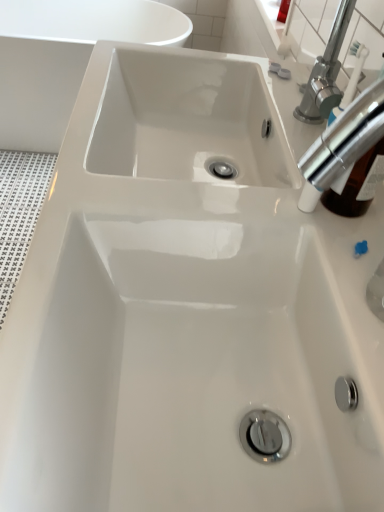
Measure the distance between white glossy bathtub at upper left and camera.

white glossy bathtub at upper left and camera are 2.10 meters apart from each other.

In order to face white glossy bathtub at upper left, should I rotate leftwards or rightwards?

A 14.519 degree turn to the left will do.

Measure the distance between point (162, 24) and camera.

Point (162, 24) and camera are 7.17 feet apart from each other.

The width and height of the screenshot is (384, 512). Describe the element at coordinates (65, 58) in the screenshot. I see `white glossy bathtub at upper left` at that location.

Locate an element on the screen. This screenshot has width=384, height=512. white glossy bathtub at upper left is located at coordinates (65, 58).

The image size is (384, 512). What are the coordinates of `chrome metallic tap at upper right` in the screenshot? It's located at (342, 144).

This screenshot has width=384, height=512. What do you see at coordinates (342, 144) in the screenshot?
I see `chrome metallic tap at upper right` at bounding box center [342, 144].

Locate an element on the screen. white glossy bathtub at upper left is located at coordinates (65, 58).

Is chrome metallic tap at upper right to the left of white glossy bathtub at upper left from the viewer's perspective?

No.

Is the position of chrome metallic tap at upper right less distant than that of white glossy bathtub at upper left?

Yes.

Which is behind, point (375, 99) or point (80, 15)?

Positioned behind is point (80, 15).

From the image's perspective, which one is positioned higher, chrome metallic tap at upper right or white glossy bathtub at upper left?

white glossy bathtub at upper left is shown above in the image.

From a real-world perspective, which object stands above the other?

In real-world perspective, chrome metallic tap at upper right is above.

Consider the image. Is chrome metallic tap at upper right wider than white glossy bathtub at upper left?

Incorrect, the width of chrome metallic tap at upper right does not surpass that of white glossy bathtub at upper left.

From their relative heights in the image, would you say chrome metallic tap at upper right is taller or shorter than white glossy bathtub at upper left?

Clearly, chrome metallic tap at upper right is shorter compared to white glossy bathtub at upper left.

Considering the relative sizes of chrome metallic tap at upper right and white glossy bathtub at upper left in the image provided, is chrome metallic tap at upper right smaller than white glossy bathtub at upper left?

Correct, chrome metallic tap at upper right occupies less space than white glossy bathtub at upper left.

Is white glossy bathtub at upper left located within chrome metallic tap at upper right?

No.

Based on the photo, can you see chrome metallic tap at upper right touching white glossy bathtub at upper left?

chrome metallic tap at upper right and white glossy bathtub at upper left are clearly separated.

Does chrome metallic tap at upper right turn towards white glossy bathtub at upper left?

No, chrome metallic tap at upper right is not oriented towards white glossy bathtub at upper left.

Where is `bath behind the chrome metallic tap at upper right`? This screenshot has height=512, width=384. bath behind the chrome metallic tap at upper right is located at coordinates (65, 58).

Considering the positions of objects white glossy bathtub at upper left and chrome metallic tap at upper right in the image provided, who is more to the right, white glossy bathtub at upper left or chrome metallic tap at upper right?

From the viewer's perspective, chrome metallic tap at upper right appears more on the right side.

Is white glossy bathtub at upper left closer to camera compared to chrome metallic tap at upper right?

That is False.

Which is nearer, (40, 6) or (339, 155)?

Point (40, 6).

From the image's perspective, does white glossy bathtub at upper left appear higher than chrome metallic tap at upper right?

Yes.

From a real-world perspective, which object stands above the other?

chrome metallic tap at upper right is physically above.

Between white glossy bathtub at upper left and chrome metallic tap at upper right, which one has larger width?

white glossy bathtub at upper left.

Which of these two, white glossy bathtub at upper left or chrome metallic tap at upper right, stands taller?

With more height is white glossy bathtub at upper left.

Does white glossy bathtub at upper left have a smaller size compared to chrome metallic tap at upper right?

Actually, white glossy bathtub at upper left might be larger than chrome metallic tap at upper right.

Would you say white glossy bathtub at upper left is outside chrome metallic tap at upper right?

That's correct, white glossy bathtub at upper left is outside of chrome metallic tap at upper right.

Is white glossy bathtub at upper left far away from chrome metallic tap at upper right?

Yes, white glossy bathtub at upper left is far from chrome metallic tap at upper right.

Is white glossy bathtub at upper left turned away from chrome metallic tap at upper right?

white glossy bathtub at upper left is not turned away from chrome metallic tap at upper right.

How different are the orientations of white glossy bathtub at upper left and chrome metallic tap at upper right in degrees?

90.3 degrees.

Based on the photo, measure the distance from white glossy bathtub at upper left to chrome metallic tap at upper right.

white glossy bathtub at upper left is 6.39 feet away from chrome metallic tap at upper right.

Identify the location of tap that appears below the white glossy bathtub at upper left (from the image's perspective). Image resolution: width=384 pixels, height=512 pixels. (342, 144).

This screenshot has height=512, width=384. Find the location of `bath behind the chrome metallic tap at upper right`. bath behind the chrome metallic tap at upper right is located at coordinates (65, 58).

Identify the location of tap that is on the right side of white glossy bathtub at upper left. This screenshot has height=512, width=384. (342, 144).